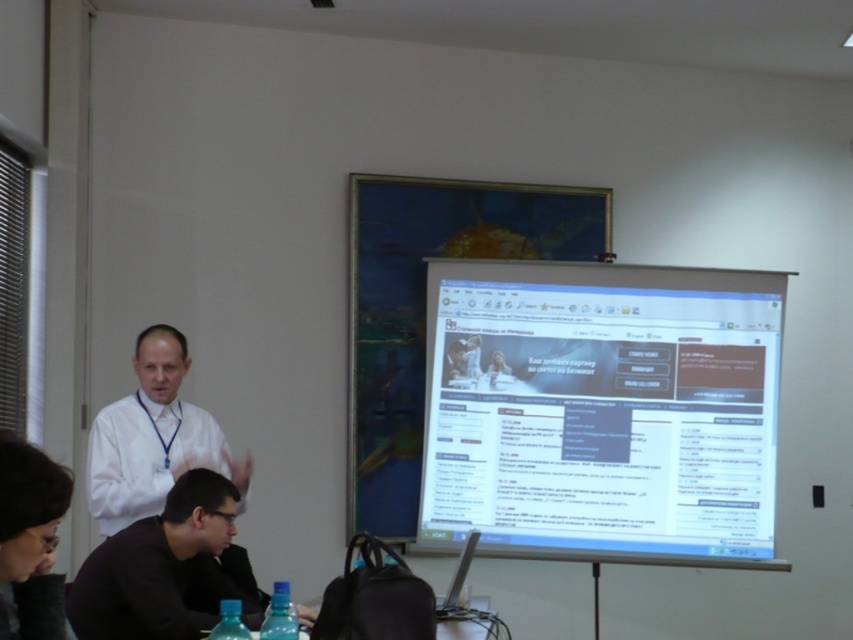
Question: Can you confirm if white shirt at left is positioned to the left of clear plastic bottles at lower center?

Choices:
 (A) yes
 (B) no

Answer: (A)

Question: Which point is closer to the camera?

Choices:
 (A) (169, 400)
 (B) (454, 538)
 (C) (187, 628)

Answer: (C)

Question: Does black matte jacket at lower center appear on the left side of clear plastic bottles at lower center?

Choices:
 (A) yes
 (B) no

Answer: (A)

Question: Which of the following is the closest to the observer?

Choices:
 (A) black matte jacket at lower center
 (B) clear plastic bottles at lower center
 (C) white glossy screen at center

Answer: (A)

Question: Which point is closer to the camera?

Choices:
 (A) clear plastic bottles at lower center
 (B) white shirt at left
 (C) black matte jacket at lower center
 (D) white glossy screen at center

Answer: (C)

Question: Does white shirt at left appear on the left side of clear plastic bottles at lower center?

Choices:
 (A) no
 (B) yes

Answer: (B)